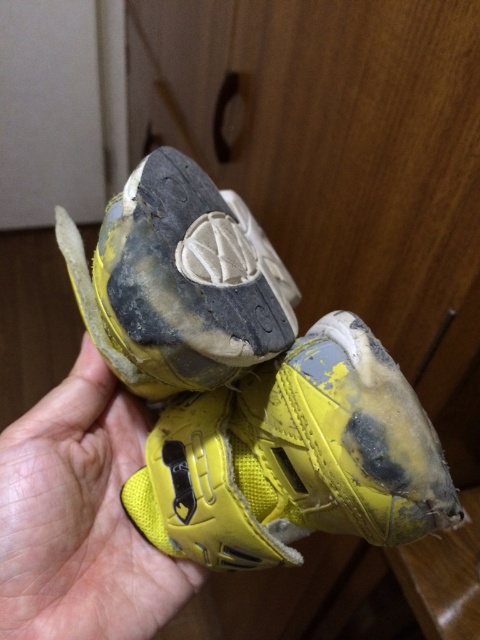
Question: Which of these objects is positioned closest to the yellow fabric hand at center?

Choices:
 (A) yellow matte shoe at center
 (B) yellow fabric shoe at center

Answer: (B)

Question: Is yellow matte shoe at center smaller than yellow fabric hand at center?

Choices:
 (A) yes
 (B) no

Answer: (B)

Question: Does yellow fabric shoe at center have a greater width compared to yellow fabric hand at center?

Choices:
 (A) yes
 (B) no

Answer: (A)

Question: Which point is farther to the camera?

Choices:
 (A) yellow fabric hand at center
 (B) yellow matte shoe at center

Answer: (A)

Question: Does yellow matte shoe at center have a smaller size compared to yellow fabric hand at center?

Choices:
 (A) yes
 (B) no

Answer: (B)

Question: Which object appears farthest from the camera in this image?

Choices:
 (A) yellow fabric shoe at center
 (B) yellow matte shoe at center

Answer: (A)